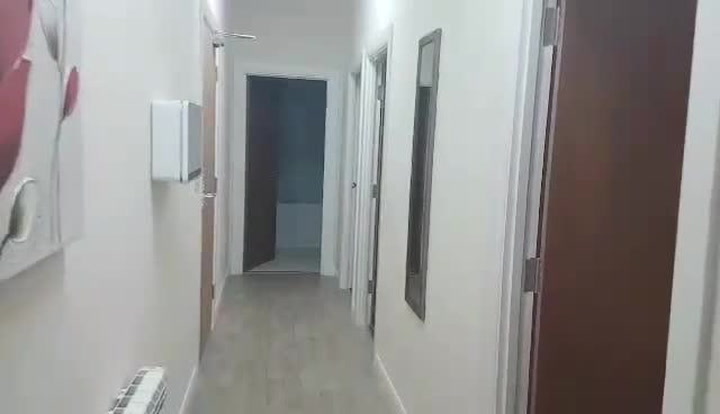
This screenshot has width=720, height=414. I want to click on door hinge, so pos(523,283), pos(544,35), pos(364,279), pos(378,186), pos(382,84).